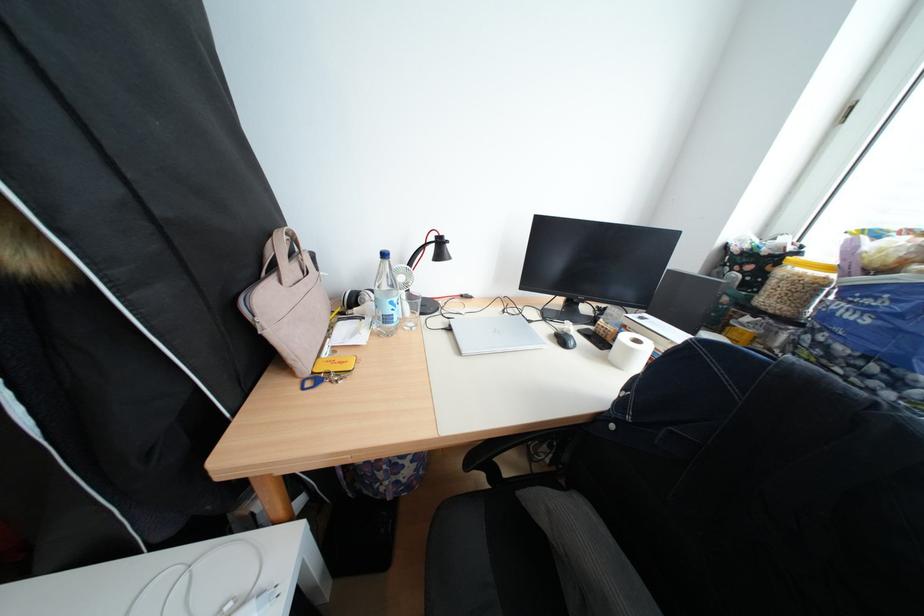
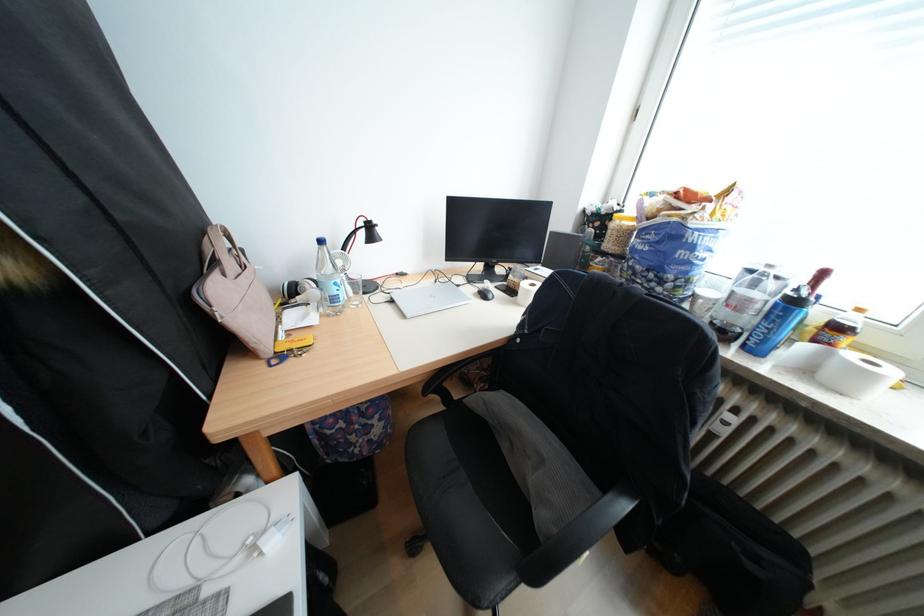
The point at (444, 249) is marked in the first image. Where is the corresponding point in the second image?

(374, 235)